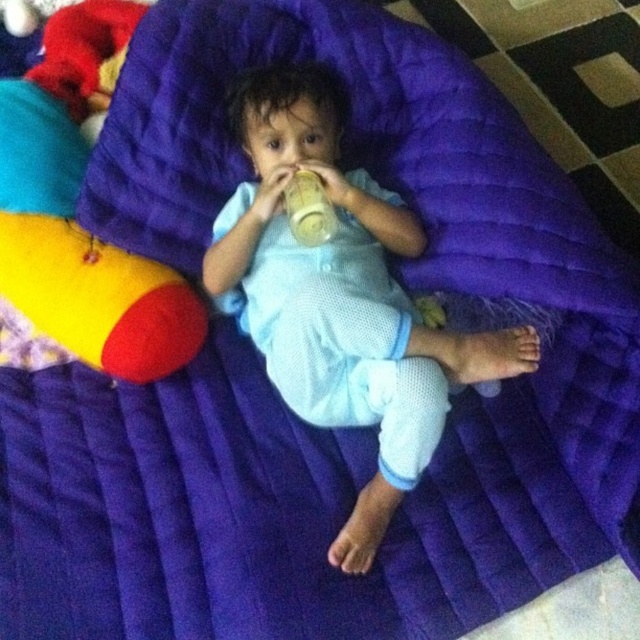
Is light blue fabric toddler at center above translucent plastic bottle at center?

No, light blue fabric toddler at center is not above translucent plastic bottle at center.

Between light blue fabric toddler at center and translucent plastic bottle at center, which one appears on the right side from the viewer's perspective?

light blue fabric toddler at center is more to the right.

The width and height of the screenshot is (640, 640). I want to click on light blue fabric toddler at center, so click(340, 298).

You are a GUI agent. You are given a task and a screenshot of the screen. Output one action in this format:
    pyautogui.click(x=<x>, y=<y>)
    Task: Click on the light blue fabric toddler at center
    
    Given the screenshot: What is the action you would take?
    pyautogui.click(x=340, y=298)